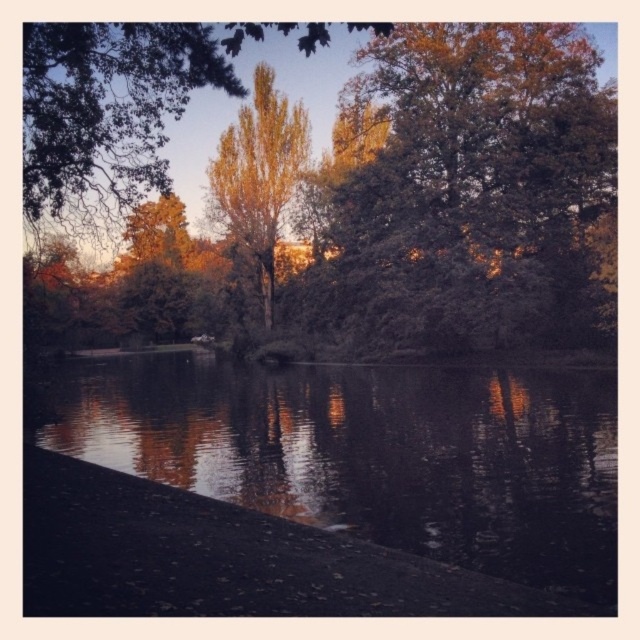
You are standing at the water edge in the autumn scene. You want to take a photo of the golden leafy tree at upper center. Where should you position yourself to capture the tree in the center of your camera view?

Since the golden leafy tree at upper center is located at coordinates point (x=124, y=106), you should position yourself directly in front of the tree along the water edge to center it in your camera view.

You are standing on the paved path and want to know which object in the scene is taller. Which one is taller between the smooth dark water at bottom center and the green leafy tree at upper center?

The green leafy tree at upper center is taller than the smooth dark water at bottom center.

You are standing on the paved path by the water and want to take a photo of the green leafy tree at upper center. If your camera has a zoom range of 40 meters, will you be able to capture the tree clearly in your photo?

The green leafy tree at upper center is 42.05 meters away from the viewer. Since the camera has a zoom range of 40 meters, it cannot reach the required distance. Therefore, the tree will appear blurry or out of focus in the photo.